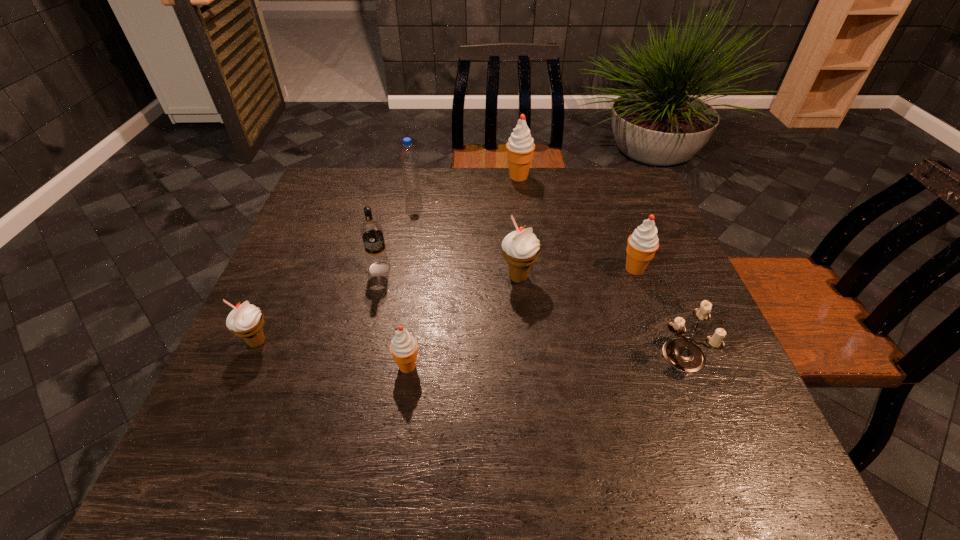
The width and height of the screenshot is (960, 540). I want to click on free point between the second icecream from left to right and the vodka, so click(394, 317).

I want to click on object identified as the third closest to the left white icecream, so 521,248.

Point out which object is positioned as the second nearest to the farther white icecream. Please provide its 2D coordinates. Your answer should be formatted as a tuple, i.e. [(x, y)], where the tuple contains the x and y coordinates of a point satisfying the conditions above.

[(403, 347)]

Select which icecream appears as the third closest to the farthest red icecream. Please provide its 2D coordinates. Your answer should be formatted as a tuple, i.e. [(x, y)], where the tuple contains the x and y coordinates of a point satisfying the conditions above.

[(403, 347)]

Locate an element on the screen. icecream that is the nearest to the fourth object from left to right is located at coordinates (521, 248).

The height and width of the screenshot is (540, 960). Identify the location of the closest red icecream relative to the second farthest object. (520, 147).

Identify which red icecream is located as the nearest to the nearer white icecream. Please provide its 2D coordinates. Your answer should be formatted as a tuple, i.e. [(x, y)], where the tuple contains the x and y coordinates of a point satisfying the conditions above.

[(403, 347)]

The height and width of the screenshot is (540, 960). What are the coordinates of `vacant space that satisfies the following two spatial constraints: 1. on the front side of the farthest object; 2. on the left side of the rightmost icecream` in the screenshot? It's located at (529, 269).